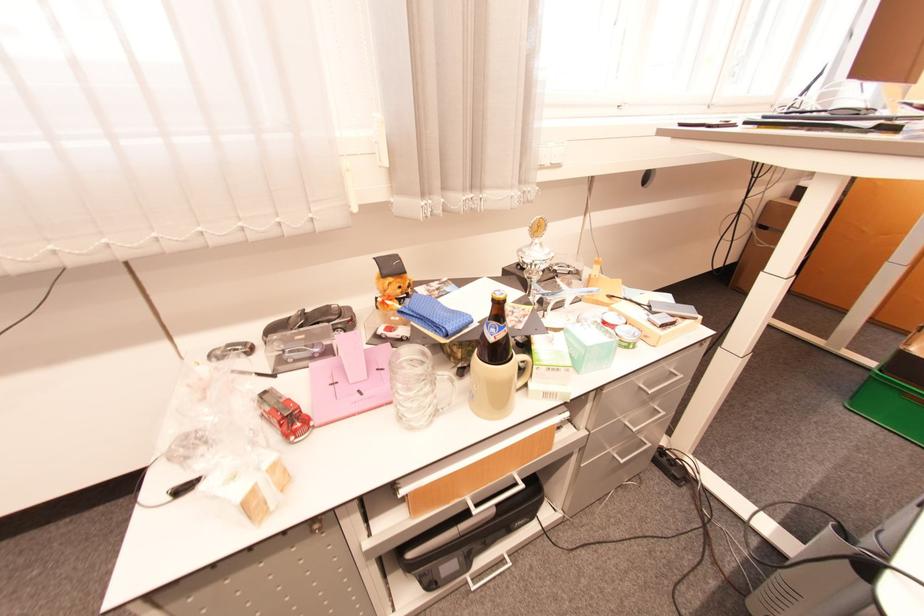
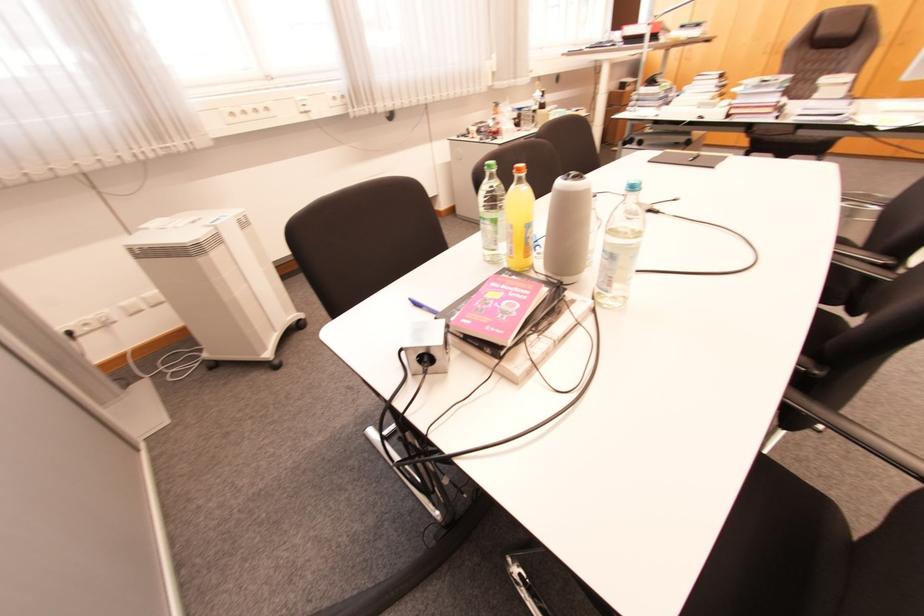
What movement of the cameraman would produce the second image?

The movement direction of the cameraman is left, backward.